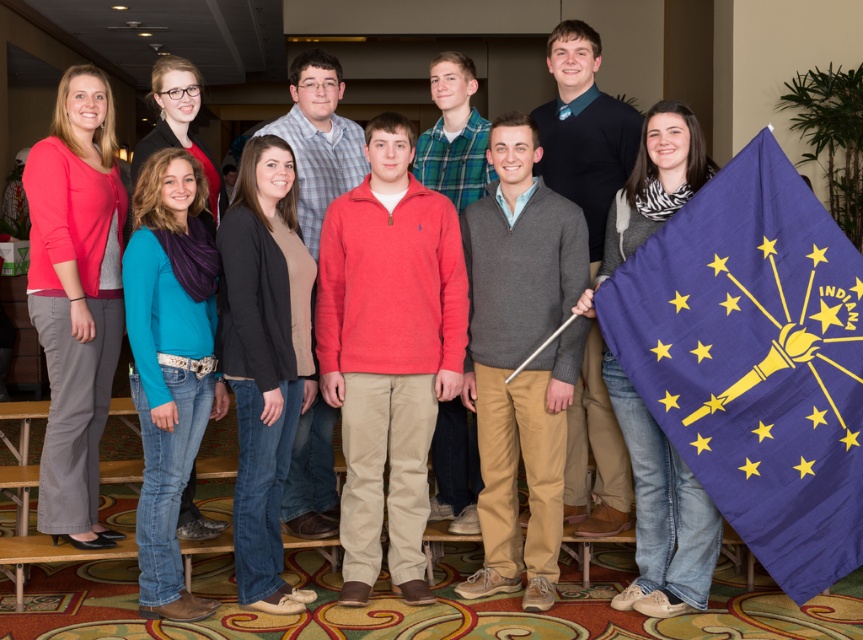
Who is positioned more to the right, blue fabric flag at lower right or black cardigan at center?

Positioned to the right is blue fabric flag at lower right.

Which is more to the left, blue fabric flag at lower right or black cardigan at center?

black cardigan at center

Find the location of a particular element. blue fabric flag at lower right is located at coordinates (754, 360).

Where is `blue fabric flag at lower right`? The image size is (863, 640). blue fabric flag at lower right is located at coordinates (754, 360).

Is point (740, 237) farther from camera compared to point (109, 378)?

No, (740, 237) is in front of (109, 378).

Is point (767, 433) positioned before point (79, 388)?

That is True.

In the scene shown: Who is more forward, (799,422) or (64,396)?

Positioned in front is point (799,422).

I want to click on blue fabric flag at lower right, so click(x=754, y=360).

Who is more forward, (172, 355) or (681, 195)?

Positioned in front is point (172, 355).

Does point (162, 321) come behind point (682, 611)?

No, it is not.

Image resolution: width=863 pixels, height=640 pixels. What are the coordinates of `teal sweater at center` in the screenshot? It's located at (169, 364).